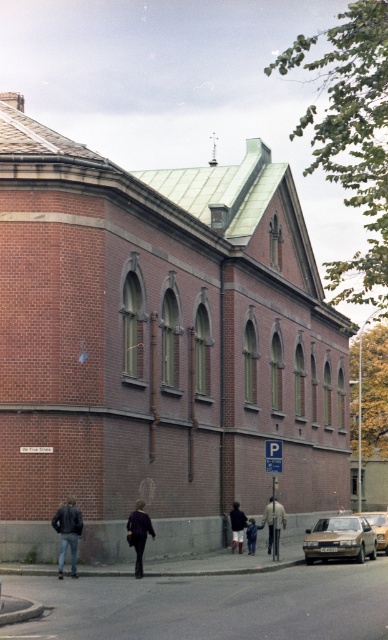
Question: Which point appears farthest from the camera in this image?

Choices:
 (A) (64, 560)
 (B) (233, 515)
 (C) (311, 556)

Answer: (B)

Question: Is brown metallic car at lower right closer to the viewer compared to dark blue jeans at center?

Choices:
 (A) yes
 (B) no

Answer: (A)

Question: Is dark purple jacket at center to the left of dark blue jeans at center from the viewer's perspective?

Choices:
 (A) no
 (B) yes

Answer: (B)

Question: Among these objects, which one is nearest to the camera?

Choices:
 (A) jeans at lower left
 (B) dark blue jeans at lower center
 (C) dark blue jeans at center
 (D) red brick church at center

Answer: (A)

Question: Which of the following is the closest to the observer?

Choices:
 (A) jeans at lower left
 (B) dark blue jeans at lower center

Answer: (A)

Question: Is silver metallic car at lower right positioned at the back of dark blue jeans at lower center?

Choices:
 (A) no
 (B) yes

Answer: (A)